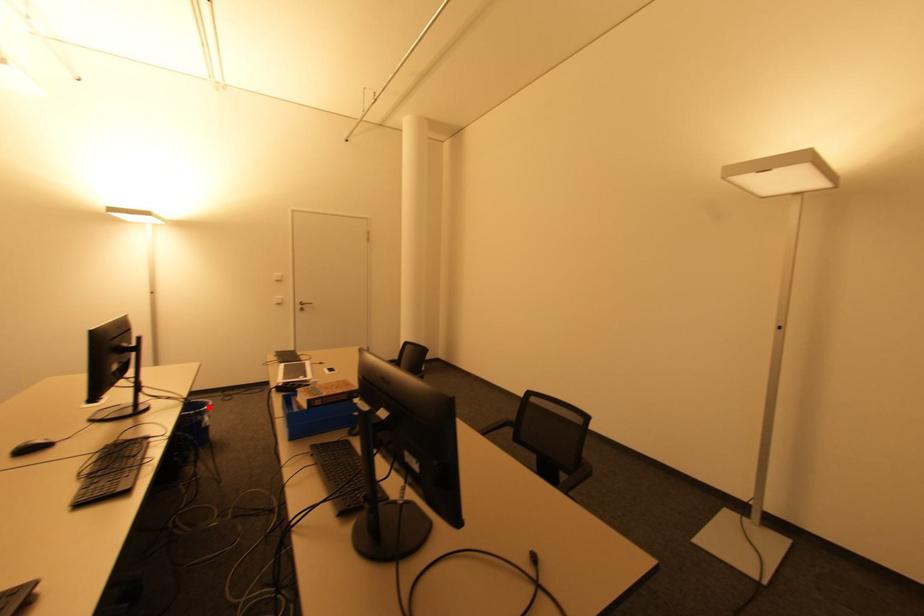
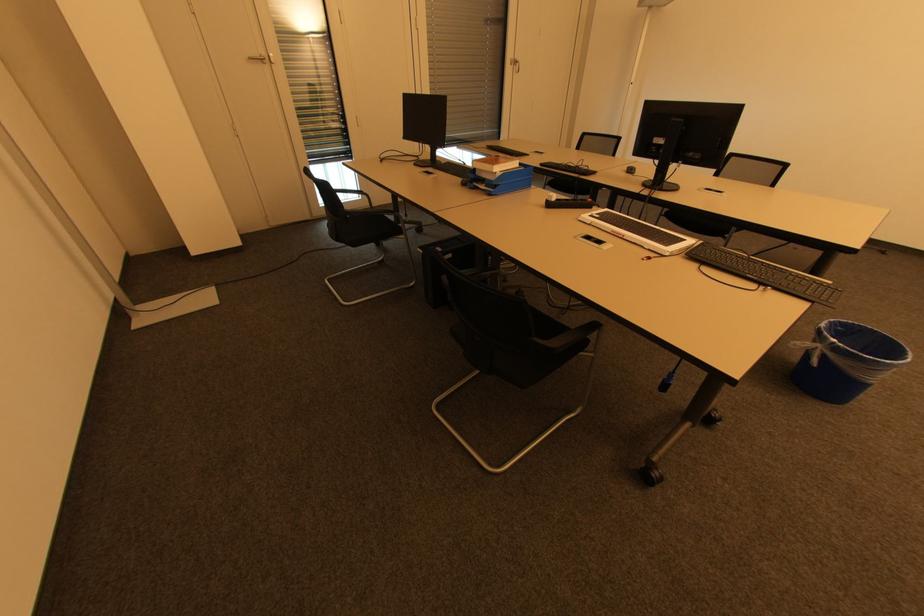
Question: I am providing you with two images of the same scene from different viewpoints. A red point is marked on the first image. Is the red point's position out of view in image 2?

Choices:
 (A) Yes
 (B) No

Answer: (B)